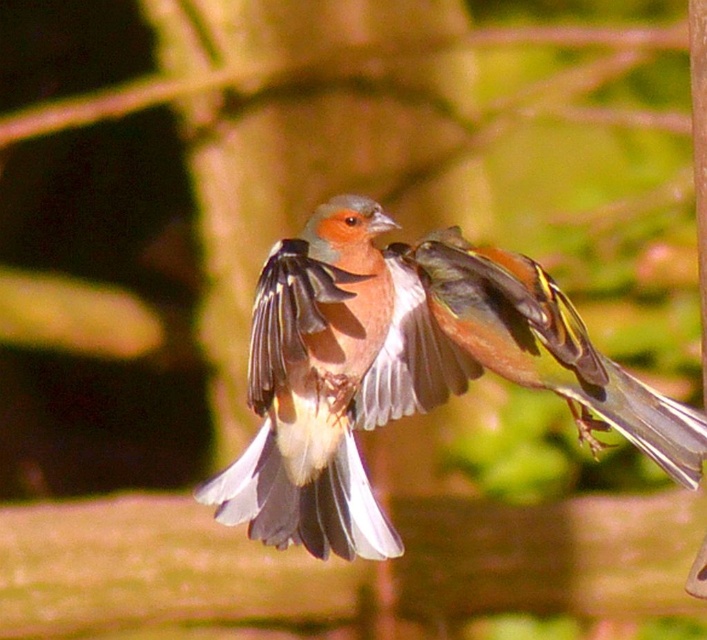
Question: Is shiny brown bird at center positioned behind matte brown bird at center?

Choices:
 (A) no
 (B) yes

Answer: (B)

Question: Among these points, which one is nearest to the camera?

Choices:
 (A) (332, 339)
 (B) (559, 333)

Answer: (B)

Question: Does shiny brown bird at center have a lesser width compared to matte brown bird at center?

Choices:
 (A) no
 (B) yes

Answer: (A)

Question: Which point is farther from the camera taking this photo?

Choices:
 (A) (436, 364)
 (B) (469, 324)

Answer: (A)

Question: Can you confirm if shiny brown bird at center is positioned to the left of matte brown bird at center?

Choices:
 (A) no
 (B) yes

Answer: (B)